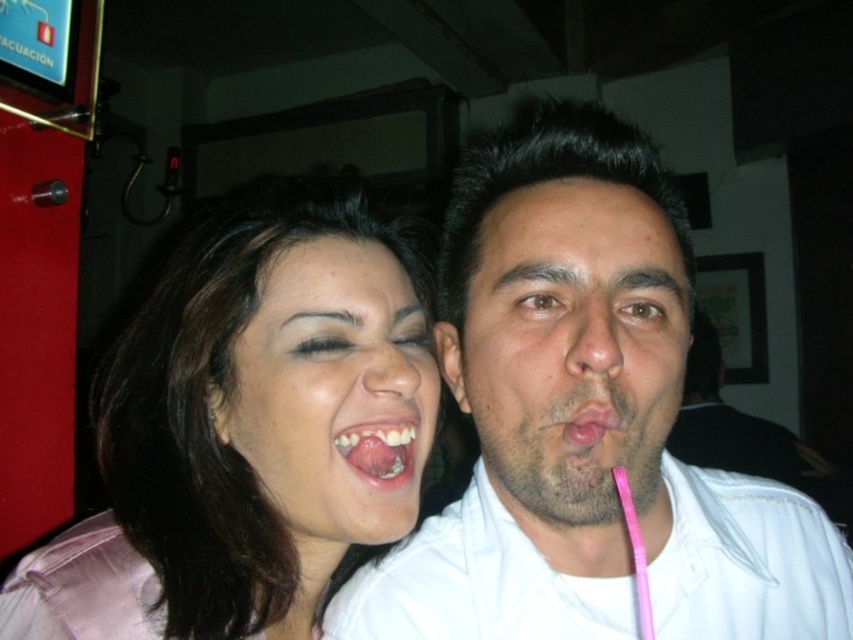
You are a bartender preparing a drink for two customers. You have a white matte shirt at center and a pink plastic straw at center in your view. Which object is positioned to the right side?

The white matte shirt at center is to the right of the pink plastic straw at center, so the white matte shirt at center is positioned to the right side.

You are a photographer trying to capture a candid shot of the two people in the image. You want to ensure that the white matte shirt at center and the smooth skin face at center are both clearly visible in the frame. Based on their positions, which one should you focus on first to ensure proper focus?

The white matte shirt at center is positioned under the smooth skin face at center, so focusing on the smooth skin face at center first would ensure that both are in focus as the shirt is below the face.